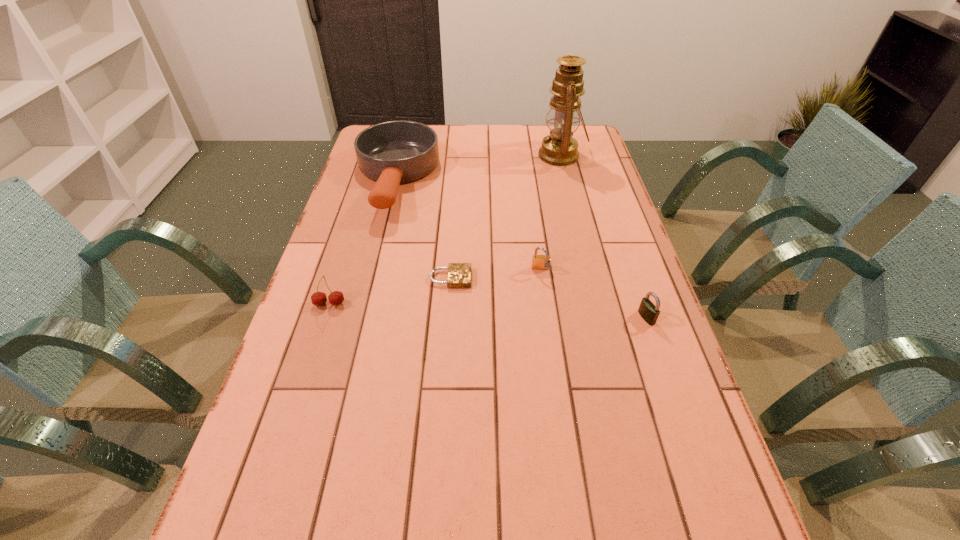
Find the location of a particular element. blank area in the image that satisfies the following two spatial constraints: 1. on the handle side of the rightmost object; 2. on the right side of the pan is located at coordinates (x=362, y=318).

At what (x,y) coordinates should I click in order to perform the action: click on free space that satisfies the following two spatial constraints: 1. on the front side of the second object from right to left; 2. on the left side of the rightmost padlock. Please return your answer as a coordinate pair (x, y). Looking at the image, I should click on (602, 318).

The height and width of the screenshot is (540, 960). I want to click on blank space that satisfies the following two spatial constraints: 1. on the keyhole side of the fourth object from right to left; 2. on the surface of the cherry, so click(x=448, y=304).